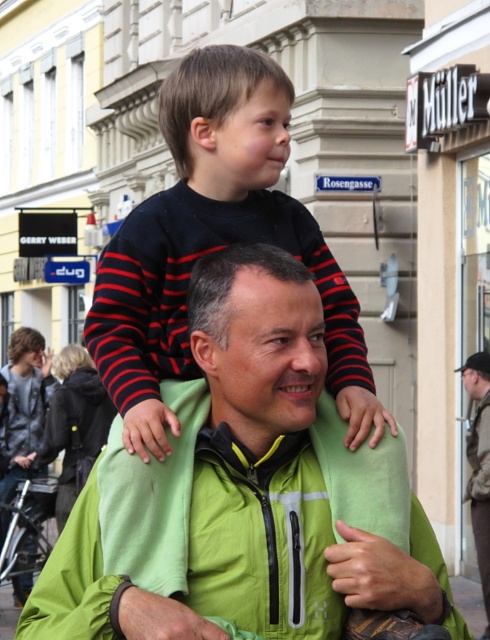
You are a photographer trying to capture the man in the green soft jacket at center. You notice a point marked at coordinates [243,492] in the image. Is this point likely to be on the man wearing the green soft jacket at center?

Yes, the point at coordinates [243,492] corresponds to the green soft jacket at center, so it is likely on the man wearing the green soft jacket at center.

You are a photographer standing 10 feet away from the two subjects in the image. You want to capture a photo where both the green soft jacket at center and the black striped shirt at center are in focus. Given that your camera has a depth of field that can sharply focus objects within a 15 inch range, will both subjects be in focus?

The green soft jacket at center and black striped shirt at center are 18.74 inches apart from each other. Since the camera can only focus within a 15 inch range, the distance between them exceeds this limit. Therefore, both subjects cannot be in focus simultaneously.

You are a photographer standing in front of the scene. You need to take a photo of the green soft jacket at center and the black striped shirt at center. According to the scene, which one is positioned to the right of the other?

The green soft jacket at center is to the right of the black striped shirt at center.